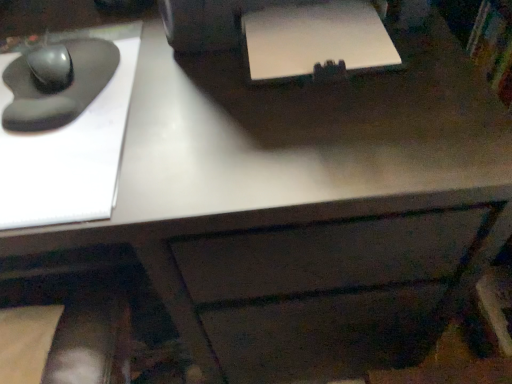
Question: Is point (31, 54) positioned closer to the camera than point (288, 43)?

Choices:
 (A) farther
 (B) closer

Answer: (A)

Question: Considering the positions of matte black mouse at left, placed as the 1th mouse when sorted from top to bottom, and white matte printer at upper center in the image, is matte black mouse at left, placed as the 1th mouse when sorted from top to bottom, wider or thinner than white matte printer at upper center?

Choices:
 (A) thin
 (B) wide

Answer: (A)

Question: Which object is the closest to the matte black mouse at left, placed as the 1th mouse when sorted from top to bottom?

Choices:
 (A) matte black mouse at left, the second mouse positioned from the top
 (B) white matte printer at upper center

Answer: (A)

Question: Which is farther from the matte black mouse at left, the first mouse when ordered from bottom to top?

Choices:
 (A) matte black mouse at left, placed as the 1th mouse when sorted from top to bottom
 (B) white matte printer at upper center

Answer: (B)